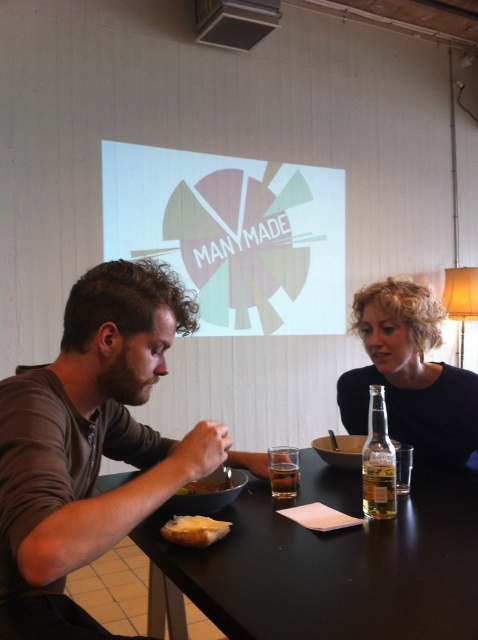
Question: Which point appears farthest from the camera in this image?

Choices:
 (A) (42, 637)
 (B) (361, 336)

Answer: (B)

Question: Based on their relative distances, which object is nearer to the green leafy vegetable at lower center?

Choices:
 (A) translucent glass bottle at table right
 (B) brown matte shirt at left
 (C) translucent glass at table center

Answer: (C)

Question: Considering the relative positions of white bread at lower center and green leafy vegetable at lower center in the image provided, where is white bread at lower center located with respect to green leafy vegetable at lower center?

Choices:
 (A) right
 (B) left

Answer: (A)

Question: From the image, what is the correct spatial relationship of brown matte shirt at left in relation to translucent glass at table center?

Choices:
 (A) above
 (B) below

Answer: (A)

Question: Which of the following is the farthest from the observer?

Choices:
 (A) matte black shirt at right
 (B) black matte table at center
 (C) translucent glass bottle at table right
 (D) pastel paper projection at center

Answer: (D)

Question: Is clear glass bottle at right to the left of green leafy vegetable at lower center from the viewer's perspective?

Choices:
 (A) yes
 (B) no

Answer: (B)